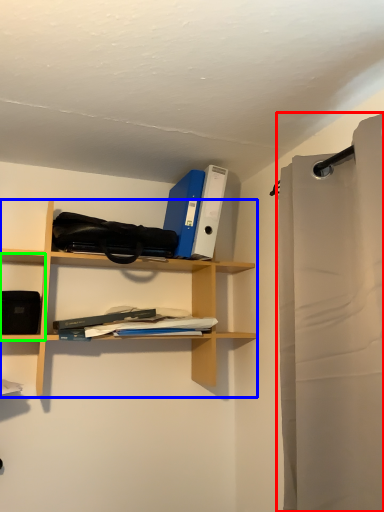
Question: Based on their relative distances, which object is farther from shower curtain (highlighted by a red box)? Choose from shelf (highlighted by a blue box) and cabinet (highlighted by a green box).

Choices:
 (A) shelf
 (B) cabinet

Answer: (B)